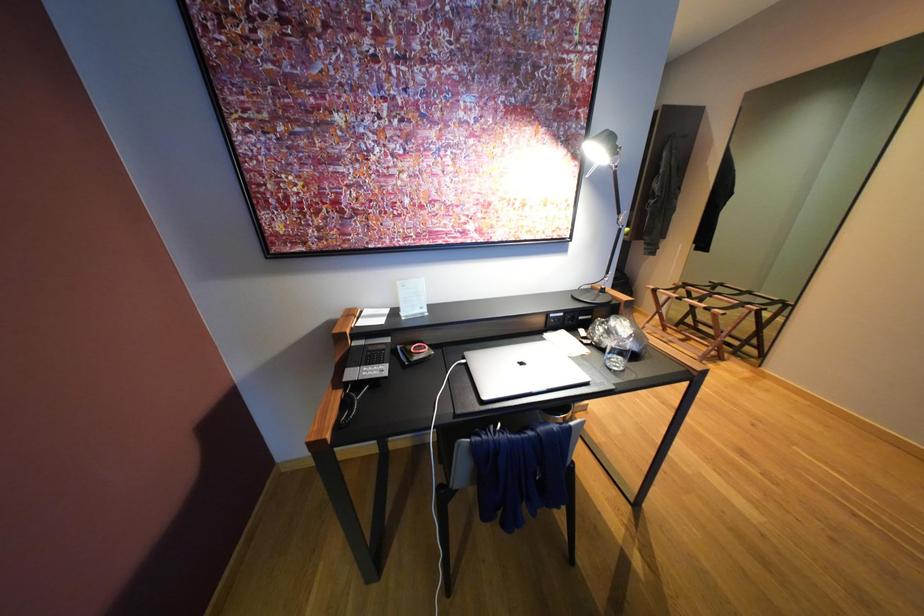
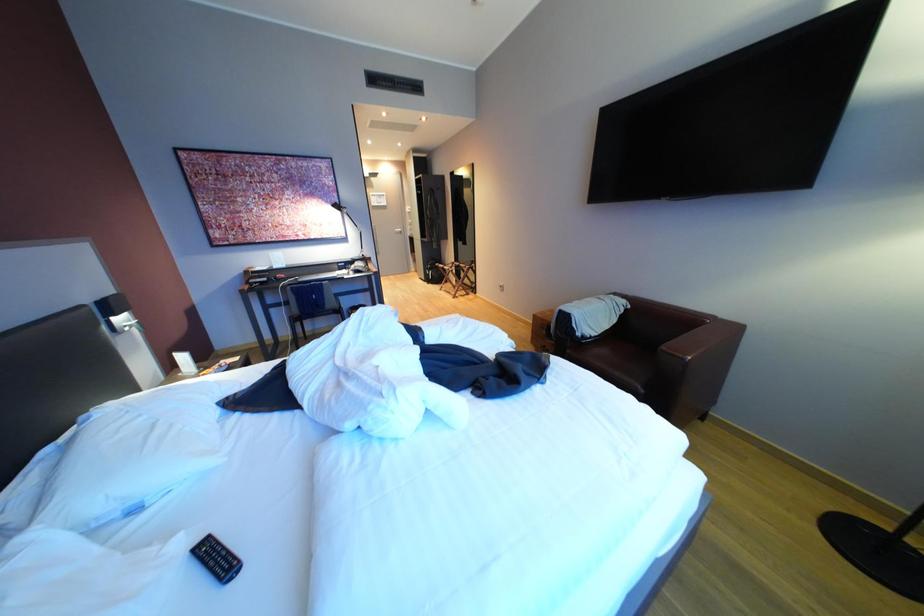
The images are taken continuously from a first-person perspective. In which direction are you moving?

The cameraman walked toward right, backward.